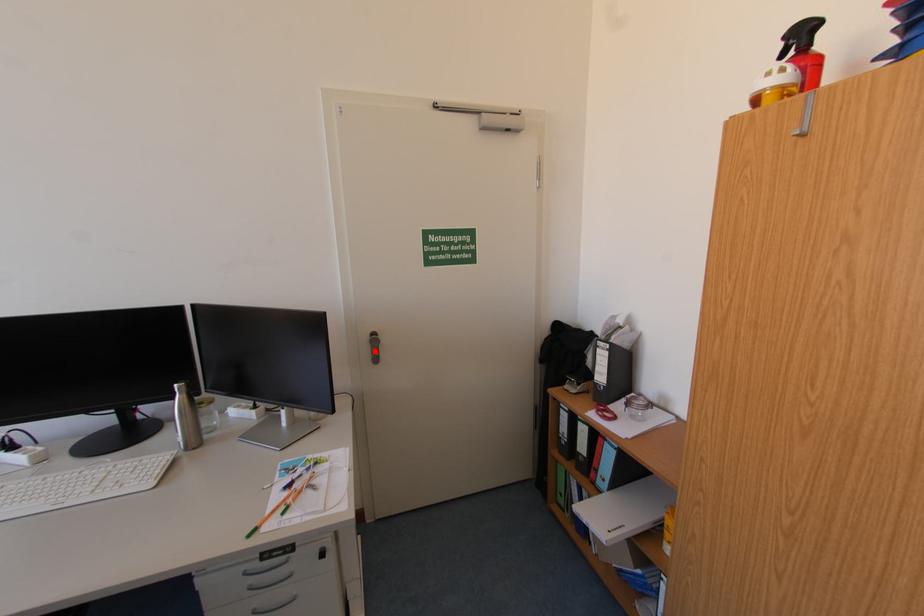
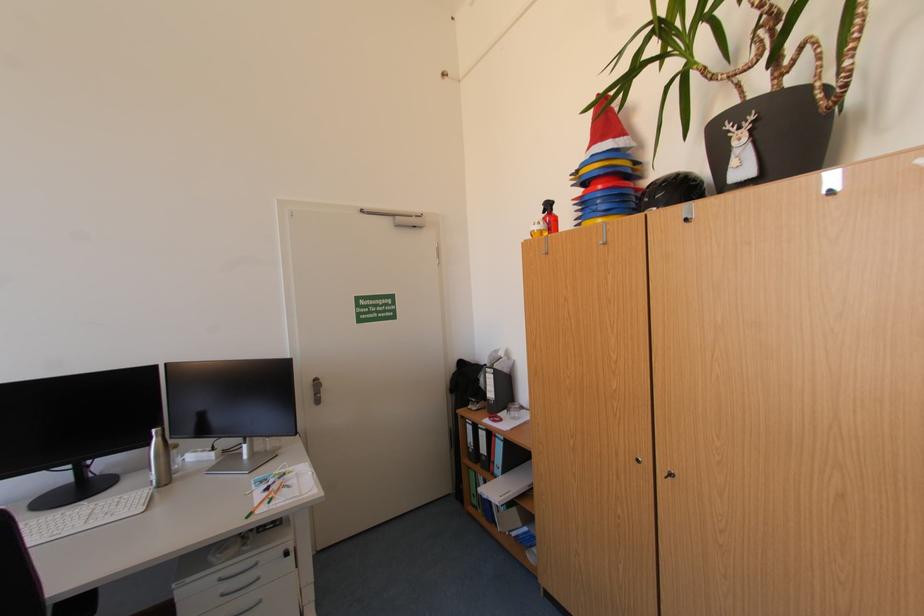
Where in the second image is the point corresponding to the highlighted location from the first image?

(319, 394)